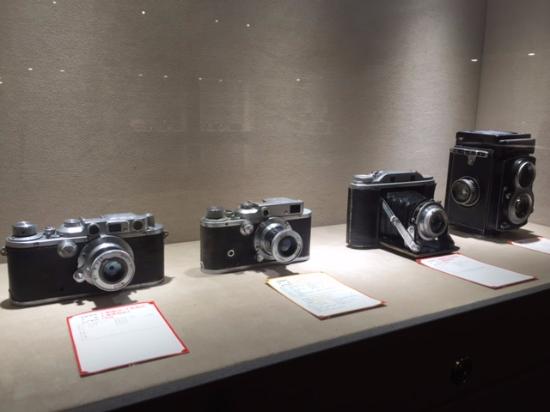
This screenshot has width=550, height=412. In order to click on hinge in this screenshot , I will do `click(405, 238)`.